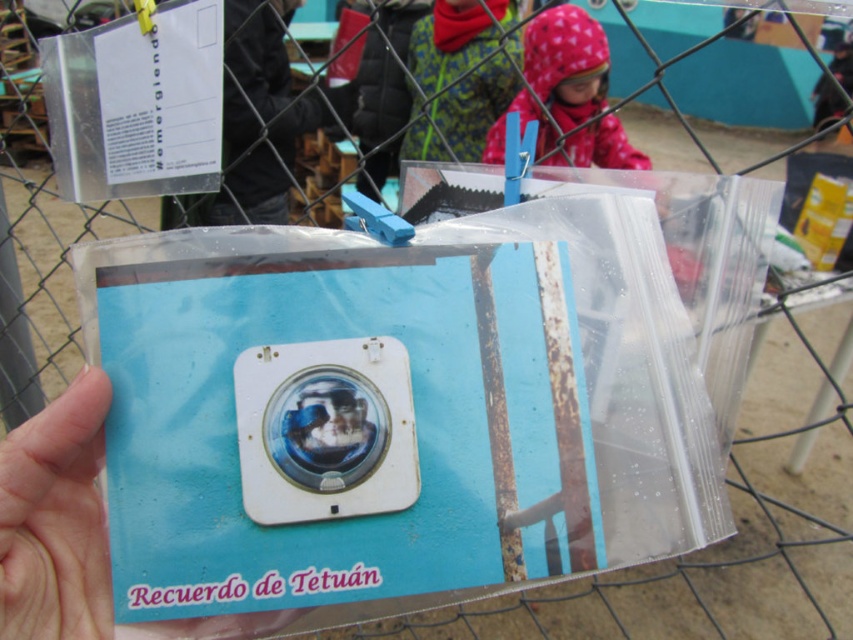
You are taking a photo with the white plastic camera at center and notice the fluffy pink hood at upper center in your viewfinder. Which object will appear larger in the photo?

The fluffy pink hood at upper center will appear larger in the photo because it is taller than the white plastic camera at center.

Based on the scene, where is the matte plastic hand at lower left located in the image? Please provide its coordinates as a point in the format of two numbers between 0 and 1, separated by a comma.

The matte plastic hand at lower left is located at point (56, 518).